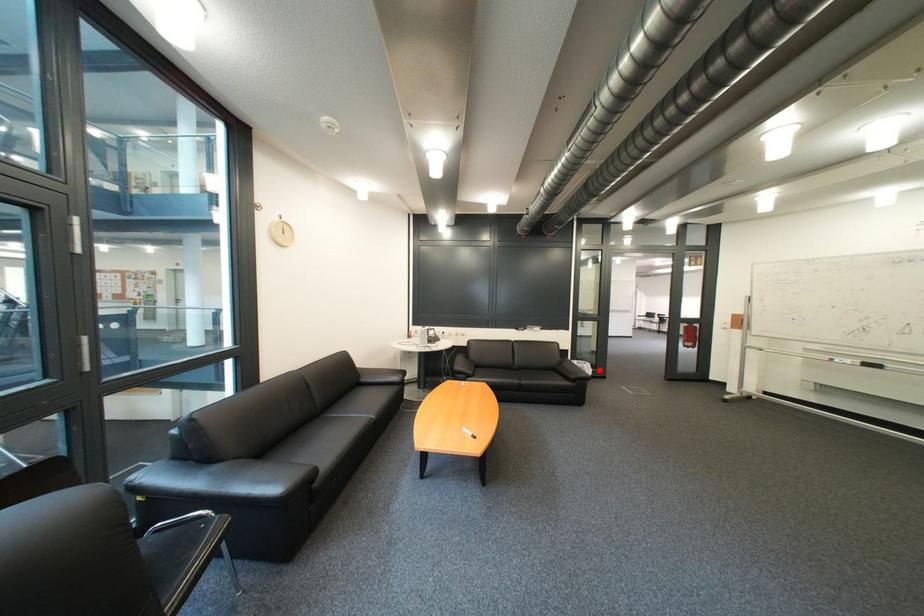
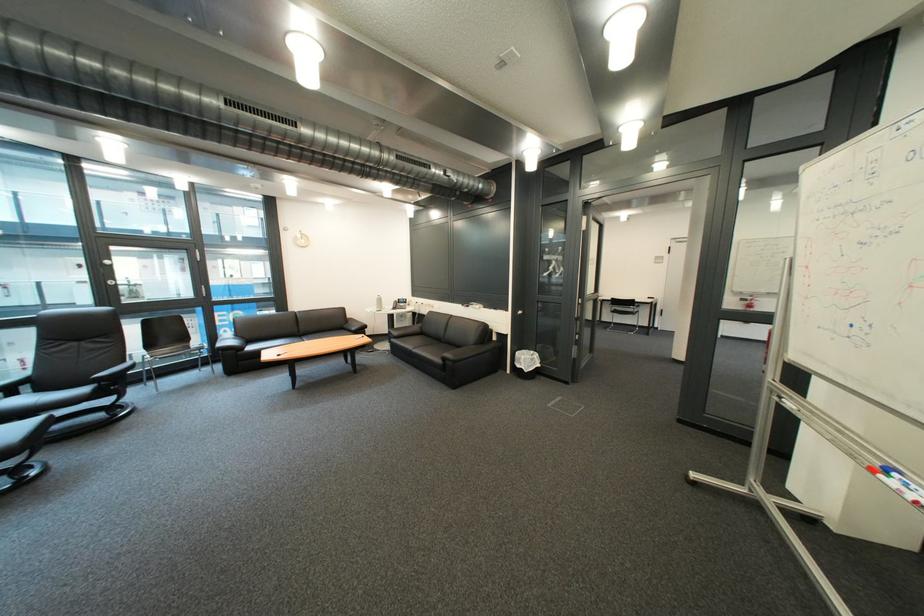
Question: I am providing you with two images of the same scene from different viewpoints. Given a red point in image1, look at the same physical point in image2. Is it:

Choices:
 (A) Closer to the viewpoint
 (B) Farther from the viewpoint

Answer: (A)